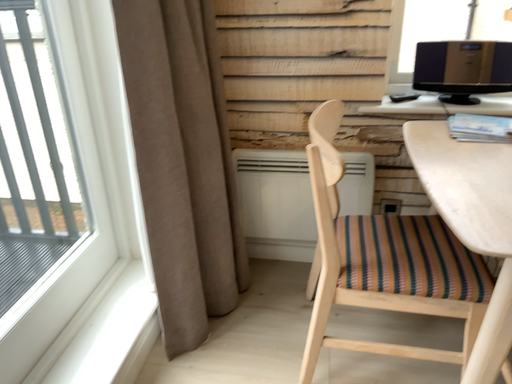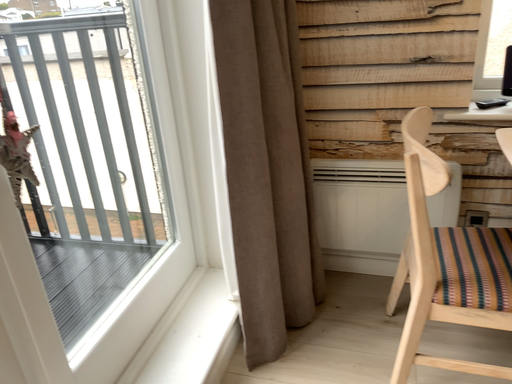
Question: How did the camera likely rotate when shooting the video?

Choices:
 (A) rotated right
 (B) rotated left

Answer: (B)